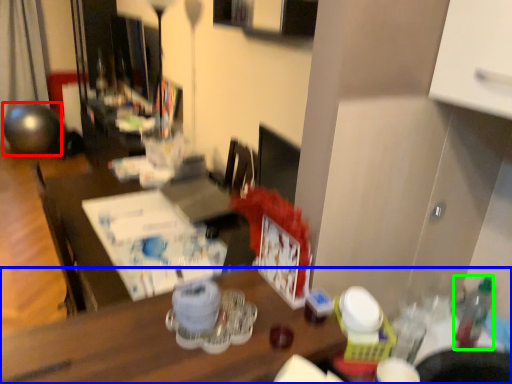
Question: Estimate the real-world distances between objects in this image. Which object is closer to ball (highlighted by a red box), desk (highlighted by a blue box) or bottle (highlighted by a green box)?

Choices:
 (A) desk
 (B) bottle

Answer: (A)